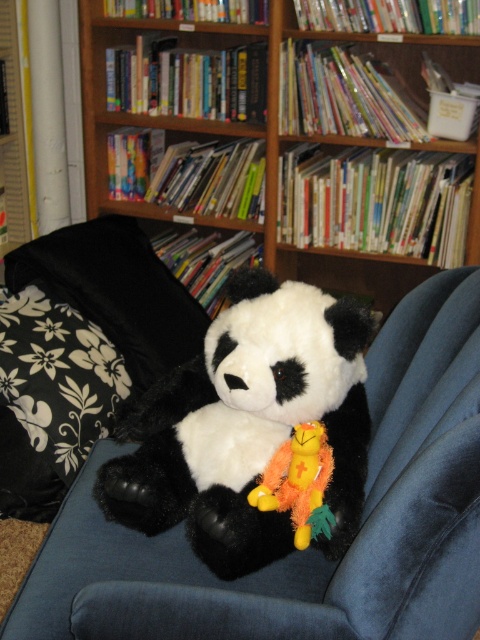
You are a child who wants to grab the fluffy yellow plush at center. You are currently sitting on the blue couch next to the panda. Can you reach it without moving the wooden bookshelf at upper center?

The fluffy yellow plush at center is behind the wooden bookshelf at upper center, so it is not visible or accessible from your current position on the blue couch. You would need to move around the bookshelf or have it moved to reach the plush.

You are a toy organizer who needs to place a new 15 cm wide plush toy on the couch. You see the soft plush panda at center and the fluffy yellow plush at center. Is there enough space between them to fit the new toy?

The distance between the soft plush panda at center and the fluffy yellow plush at center is 13.44 centimeters. Since the new toy is 15 cm wide, there isn not enough space between them to fit the new toy.

You are a child who wants to place a new book on the wooden bookshelf at upper center and the fluffy yellow plush at center. Which object has a wider surface to place the book?

The wooden bookshelf at upper center has a wider surface than the fluffy yellow plush at center because the wooden bookshelf at upper center is wider in width according to the description.